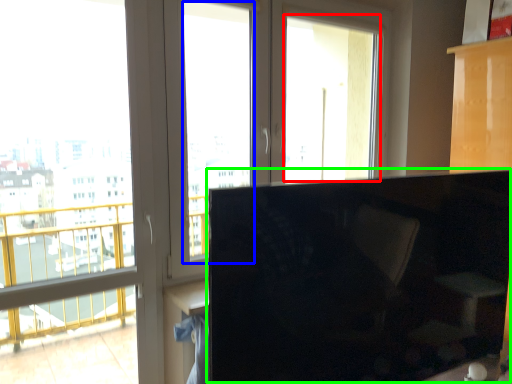
Question: Which object is positioned closest to window screen (highlighted by a red box)? Select from window screen (highlighted by a blue box) and computer monitor (highlighted by a green box).

Choices:
 (A) window screen
 (B) computer monitor

Answer: (A)